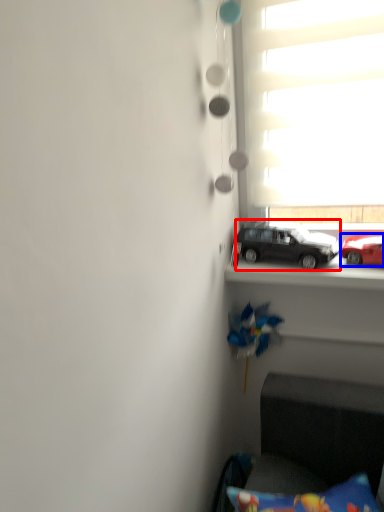
Question: Which object appears farthest to the camera in this image, car (highlighted by a red box) or car (highlighted by a blue box)?

Choices:
 (A) car
 (B) car

Answer: (A)